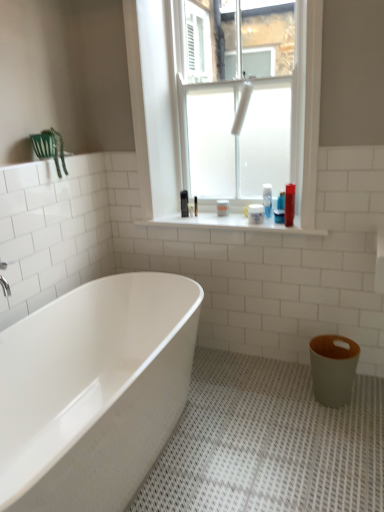
Describe the element at coordinates (154, 105) in the screenshot. The width and height of the screenshot is (384, 512). I see `frosted glass window at upper center` at that location.

What do you see at coordinates (289, 204) in the screenshot? I see `matte plastic bottle at upper right, marked as the fourth toiletry in a back-to-front arrangement` at bounding box center [289, 204].

What is the approximate width of translucent plastic bottle at upper center, placed as the 2th toiletry when sorted from back to front?

It is 2.44 inches.

This screenshot has height=512, width=384. What do you see at coordinates (280, 209) in the screenshot?
I see `translucent plastic bottle at upper center, positioned as the third toiletry in left-to-right order` at bounding box center [280, 209].

This screenshot has height=512, width=384. What are the coordinates of `translucent plastic container at center, which is counted as the first toiletry, starting from the left` in the screenshot? It's located at click(x=222, y=208).

Find the location of `white glossy bathtub at lower left`. white glossy bathtub at lower left is located at coordinates coord(94,391).

This screenshot has height=512, width=384. Describe the element at coordinates (229, 223) in the screenshot. I see `white glossy shelf at center` at that location.

The image size is (384, 512). Identify the location of frosted glass window at upper center. (154, 105).

Considering the positions of objects translucent plastic bottle at upper center, marked as the second toiletry in a right-to-left arrangement, and green fabric plant at upper left in the image provided, who is behind, translucent plastic bottle at upper center, marked as the second toiletry in a right-to-left arrangement, or green fabric plant at upper left?

Positioned behind is translucent plastic bottle at upper center, marked as the second toiletry in a right-to-left arrangement.

Is translucent plastic bottle at upper center, marked as the second toiletry in a right-to-left arrangement, oriented away from green fabric plant at upper left?

No, green fabric plant at upper left is not at the back of translucent plastic bottle at upper center, marked as the second toiletry in a right-to-left arrangement.

Is translucent plastic bottle at upper center, positioned as the third toiletry in left-to-right order, inside or outside of green fabric plant at upper left?

The correct answer is: outside.

How much distance is there between translucent plastic bottle at upper center, marked as the second toiletry in a right-to-left arrangement, and green fabric plant at upper left?

The distance of translucent plastic bottle at upper center, marked as the second toiletry in a right-to-left arrangement, from green fabric plant at upper left is 1.14 meters.

From a real-world perspective, does white glossy bathtub at lower left sit lower than frosted glass window at upper center?

Correct, in the physical world, white glossy bathtub at lower left is lower than frosted glass window at upper center.

I want to click on window lying behind the white glossy bathtub at lower left, so click(x=154, y=105).

Does point (174, 355) come closer to viewer compared to point (157, 3)?

Yes, point (174, 355) is in front of point (157, 3).

Can you confirm if white glossy bathtub at lower left is positioned to the left of frosted glass window at upper center?

Yes.

From a real-world perspective, is white glossy shelf at center located beneath frosted glass window at upper center?

Correct, in the physical world, white glossy shelf at center is lower than frosted glass window at upper center.

From the image's perspective, which one is positioned higher, white glossy shelf at center or frosted glass window at upper center?

frosted glass window at upper center appears higher in the image.

The image size is (384, 512). I want to click on window sill behind the frosted glass window at upper center, so (x=229, y=223).

Who is more distant, translucent plastic container at center, which is the fourth toiletry from right to left, or translucent plastic bottle at upper center, acting as the 3th toiletry starting from the front?

translucent plastic container at center, which is the fourth toiletry from right to left, is more distant.

From a real-world perspective, is translucent plastic container at center, the fourth toiletry when ordered from front to back, physically above translucent plastic bottle at upper center, placed as the 2th toiletry when sorted from back to front?

No, from a real-world perspective, translucent plastic container at center, the fourth toiletry when ordered from front to back, is not over translucent plastic bottle at upper center, placed as the 2th toiletry when sorted from back to front

Does translucent plastic container at center, which appears as the first toiletry when viewed from the back, turn towards translucent plastic bottle at upper center, acting as the 3th toiletry starting from the front?

No.

Is green fabric plant at upper left at the right side of white matte container at upper center, which is the second toiletry in front-to-back order?

No.

Is green fabric plant at upper left not close to white matte container at upper center, which ranks as the 2th toiletry in left-to-right order?

That's right, there is a large distance between green fabric plant at upper left and white matte container at upper center, which ranks as the 2th toiletry in left-to-right order.

From the image's perspective, who appears lower, green fabric plant at upper left or white matte container at upper center, arranged as the third toiletry when viewed from the back?

white matte container at upper center, arranged as the third toiletry when viewed from the back, is shown below in the image.

Based on the photo, is translucent plastic bottle at upper center, placed as the 2th toiletry when sorted from back to front, a part of green fabric plant at upper left?

Actually, translucent plastic bottle at upper center, placed as the 2th toiletry when sorted from back to front, is outside green fabric plant at upper left.

Is green fabric plant at upper left facing towards translucent plastic bottle at upper center, acting as the 3th toiletry starting from the front?

No.

At what (x,y) coordinates should I click in order to perform the action: click on plant that is above the translucent plastic bottle at upper center, placed as the 2th toiletry when sorted from back to front (from a real-world perspective). Please return your answer as a coordinate pair (x, y). Image resolution: width=384 pixels, height=512 pixels. Looking at the image, I should click on (57, 149).

Is white glossy shelf at center with green fabric plant at upper left?

No, white glossy shelf at center is not next to green fabric plant at upper left.

Would you say green fabric plant at upper left is part of white glossy shelf at center's contents?

No, white glossy shelf at center does not contain green fabric plant at upper left.

Looking at their sizes, would you say white glossy shelf at center is wider or thinner than green fabric plant at upper left?

Considering their sizes, white glossy shelf at center looks broader than green fabric plant at upper left.

Where is `toiletry that is the 2nd one below the green fabric plant at upper left (from a real-world perspective)`? toiletry that is the 2nd one below the green fabric plant at upper left (from a real-world perspective) is located at coordinates (280, 209).

Identify the location of window behind the white glossy bathtub at lower left. The width and height of the screenshot is (384, 512). (154, 105).

From the image, which object appears to be farther from matte gray toilet bowl at lower right, translucent plastic bottle at upper center, placed as the 2th toiletry when sorted from back to front, or white glossy shelf at center?

Among the two, translucent plastic bottle at upper center, placed as the 2th toiletry when sorted from back to front, is located further to matte gray toilet bowl at lower right.

From the image, which object appears to be farther from green fabric plant at upper left, translucent plastic container at center, which appears as the first toiletry when viewed from the back, or matte plastic bottle at upper right, marked as the fourth toiletry in a back-to-front arrangement?

matte plastic bottle at upper right, marked as the fourth toiletry in a back-to-front arrangement, is positioned further to the anchor green fabric plant at upper left.

Based on their spatial positions, is green fabric plant at upper left or translucent plastic container at center, which appears as the first toiletry when viewed from the back, further from white glossy shelf at center?

green fabric plant at upper left is further to white glossy shelf at center.

Based on their spatial positions, is translucent plastic container at center, which appears as the first toiletry when viewed from the back, or frosted glass window at upper center closer to white matte container at upper center, which ranks as the 2th toiletry in left-to-right order?

Among the two, translucent plastic container at center, which appears as the first toiletry when viewed from the back, is located nearer to white matte container at upper center, which ranks as the 2th toiletry in left-to-right order.

Estimate the real-world distances between objects in this image. Which object is closer to translucent plastic container at center, the fourth toiletry when ordered from front to back, frosted glass window at upper center or matte gray toilet bowl at lower right?

The object closer to translucent plastic container at center, the fourth toiletry when ordered from front to back, is frosted glass window at upper center.

In the scene shown: When comparing their distances from frosted glass window at upper center, does green fabric plant at upper left or white glossy bathtub at lower left seem closer?

green fabric plant at upper left is positioned closer to the anchor frosted glass window at upper center.

Which object lies further to the anchor point white glossy bathtub at lower left, translucent plastic container at center, which is the fourth toiletry from right to left, or matte gray toilet bowl at lower right?

translucent plastic container at center, which is the fourth toiletry from right to left, is further to white glossy bathtub at lower left.

Estimate the real-world distances between objects in this image. Which object is closer to translucent plastic container at center, the fourth toiletry when ordered from front to back, translucent plastic bottle at upper center, acting as the 3th toiletry starting from the front, or white glossy bathtub at lower left?

translucent plastic bottle at upper center, acting as the 3th toiletry starting from the front, is closer to translucent plastic container at center, the fourth toiletry when ordered from front to back.

Where is `window sill that lies between frosted glass window at upper center and white glossy bathtub at lower left from top to bottom`? This screenshot has width=384, height=512. window sill that lies between frosted glass window at upper center and white glossy bathtub at lower left from top to bottom is located at coordinates (229, 223).

Identify the location of window sill located between white glossy bathtub at lower left and translucent plastic bottle at upper center, positioned as the third toiletry in left-to-right order, in the depth direction. (229, 223).

Image resolution: width=384 pixels, height=512 pixels. Identify the location of window located between white glossy bathtub at lower left and translucent plastic container at center, which is counted as the first toiletry, starting from the left, in the depth direction. (154, 105).

This screenshot has height=512, width=384. Identify the location of plant located between white glossy bathtub at lower left and matte plastic bottle at upper right, marked as the fourth toiletry in a back-to-front arrangement, in the depth direction. (57, 149).